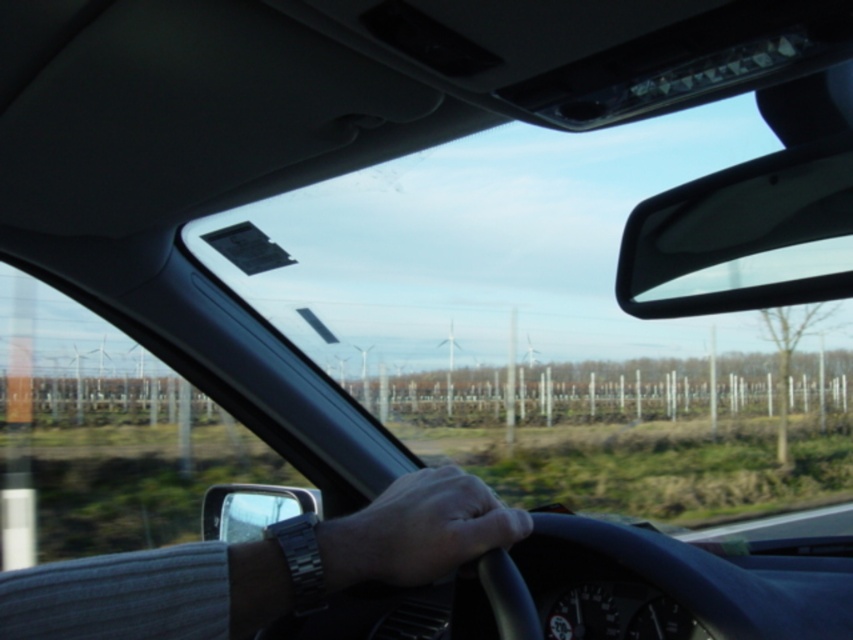
You are the driver and you want to check the time on your silver metallic wristwatch at center while also glancing at the black glossy view mirror at upper right. Which object will you look at first if you want to check the time without moving your head?

The silver metallic wristwatch at center is smaller in size compared to the black glossy view mirror at upper right, so you should look at the silver metallic wristwatch at center first to check the time since it requires a closer and more direct gaze without moving your head.

You are a passenger in the car and want to check the driver is wearing a watch. Which object is closer to the center of the image, the silver metallic wristwatch at center or the smooth skin hand at center?

The silver metallic wristwatch at center is to the left of the smooth skin hand at center, so the smooth skin hand at center is closer to the center of the image.